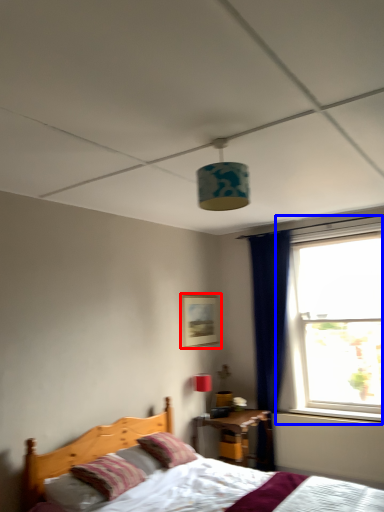
Question: Which object appears farthest to the camera in this image, picture frame (highlighted by a red box) or window (highlighted by a blue box)?

Choices:
 (A) picture frame
 (B) window

Answer: (A)